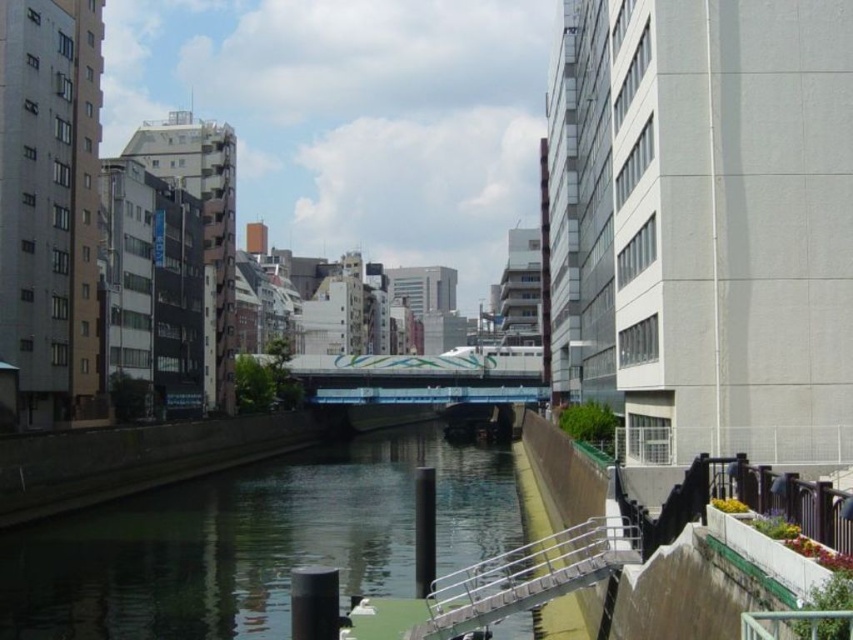
Which is more to the right, green smooth water at center or silver metallic railing at lower center?

silver metallic railing at lower center is more to the right.

Which is behind, point (466, 536) or point (485, 618)?

The point (466, 536) is behind.

Does point (224, 480) come closer to viewer compared to point (523, 609)?

That is False.

Where is `green smooth water at center`? This screenshot has width=853, height=640. green smooth water at center is located at coordinates (253, 541).